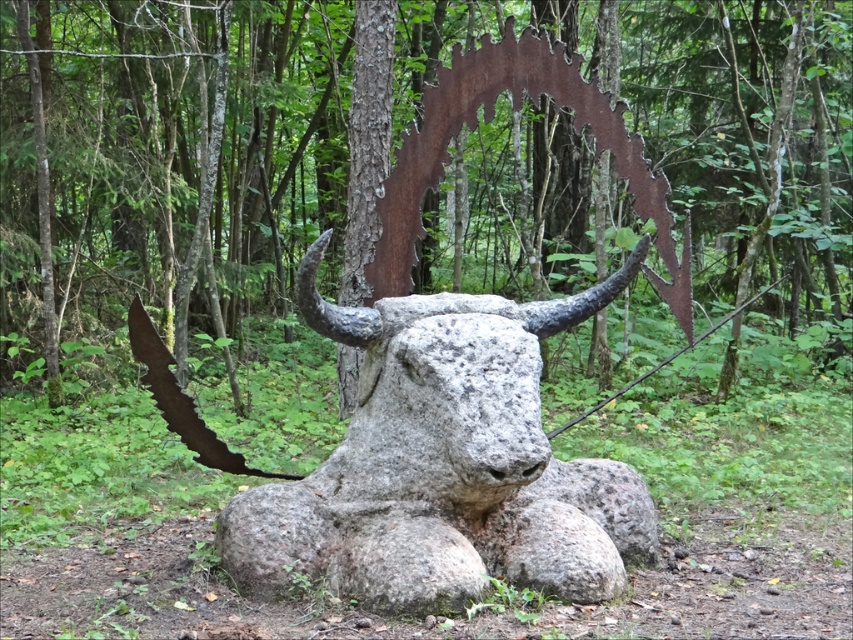
What are the coordinates of the rusty metal tree at center?

The coordinates of the rusty metal tree at center are point (743,131).

You are an artist planning to install a new sculpture between the rusty metal tree at center and the gray stone bull at center in the forest. The new sculpture is 2 meters wide. Can you fit it between them without moving either existing sculptures?

The distance between the rusty metal tree at center and the gray stone bull at center is 9.14 meters. Since the new sculpture is only 2 meters wide, there is sufficient space to place it between them without moving either existing sculpture.